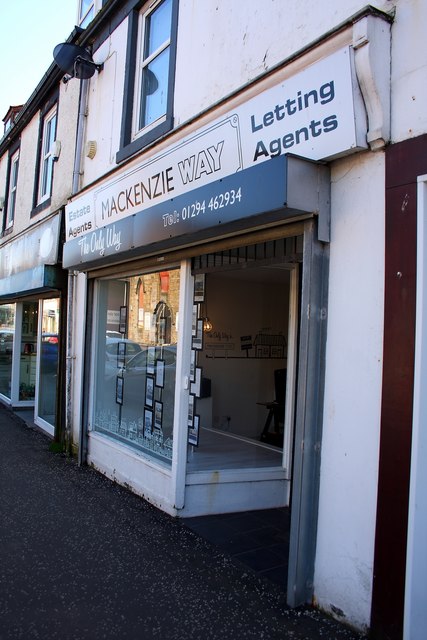
Locate an element on the screen. The height and width of the screenshot is (640, 427). dish is located at coordinates (78, 59).